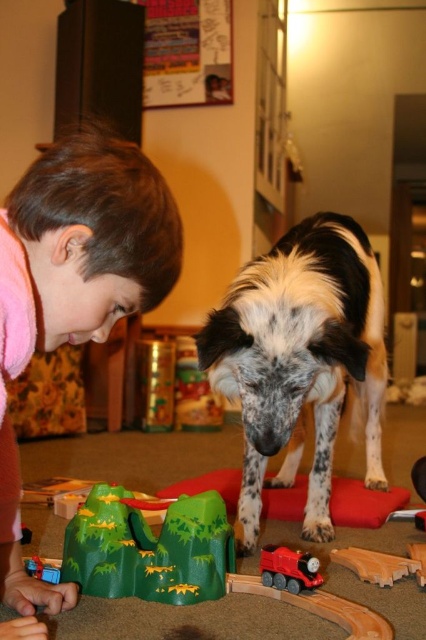
You are a parent standing at the edge of the room. You see your child interacting with a toy train set and the spotted fur dog at center. If you want to reach the child quickly, how many steps would you need to take if each step covers 0.75 meters?

The distance between the spotted fur dog at center and the viewer is 1.33 meters. Assuming the child is near the dog, you would need approximately 2 steps to cover 1.33 meters with each step being 0.75 meters.

You have a rectangular box that is 10 cm wide. You need to place either the pink fleece at lower left or the green matte mountain at center into it. Which object can fit inside the box?

The pink fleece at lower left can fit inside the box because its width is less than the green matte mountain at center, making it narrower than the 10 cm width of the box.